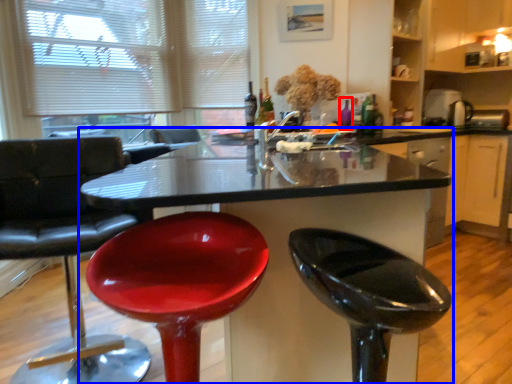
Question: Which of the following is the closest to the observer, bottle (highlighted by a red box) or kitchen & dining room table (highlighted by a blue box)?

Choices:
 (A) bottle
 (B) kitchen & dining room table

Answer: (B)